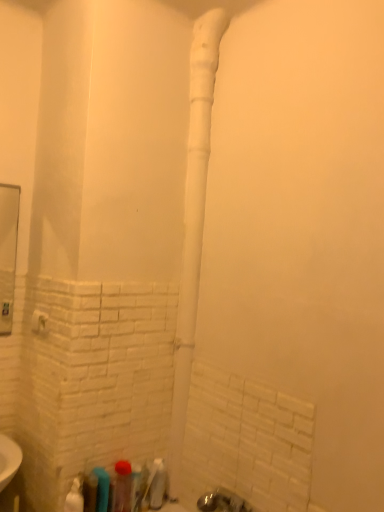
The width and height of the screenshot is (384, 512). Describe the element at coordinates (90, 492) in the screenshot. I see `translucent plastic bottle at lower left, which is the fifth toiletry from right to left` at that location.

In order to face translucent plastic bottle at lower center, which is the fourth toiletry from left to right, should I rotate leftwards or rightwards?

You should rotate left by 9.061 degrees.

Image resolution: width=384 pixels, height=512 pixels. Describe the element at coordinates (122, 487) in the screenshot. I see `translucent plastic bottle at lower center, which is the fourth toiletry from left to right` at that location.

What do you see at coordinates (74, 498) in the screenshot? Image resolution: width=384 pixels, height=512 pixels. I see `white glossy spray bottle at lower left, which is counted as the sixth toiletry, starting from the right` at bounding box center [74, 498].

This screenshot has height=512, width=384. What are the coordinates of `translucent plastic bottle at lower center, which ranks as the sixth toiletry in left-to-right order` in the screenshot? It's located at (157, 483).

Where is `towel bar above the white glossy spray bottle at lower left, the 1th toiletry positioned from the left (from the image's perspective)`? This screenshot has width=384, height=512. towel bar above the white glossy spray bottle at lower left, the 1th toiletry positioned from the left (from the image's perspective) is located at coordinates (40, 322).

From the picture: How far apart are white glossy spray bottle at lower left, the 1th toiletry positioned from the left, and white plastic towel bar at lower left?

The distance of white glossy spray bottle at lower left, the 1th toiletry positioned from the left, from white plastic towel bar at lower left is 23.30 inches.

In the scene shown: In the image, is white glossy spray bottle at lower left, which is counted as the sixth toiletry, starting from the right, positioned in front of or behind white plastic towel bar at lower left?

Clearly, white glossy spray bottle at lower left, which is counted as the sixth toiletry, starting from the right, is in front of white plastic towel bar at lower left.

In terms of size, does white glossy spray bottle at lower left, the 1th toiletry positioned from the left, appear bigger or smaller than white plastic towel bar at lower left?

Considering their sizes, white glossy spray bottle at lower left, the 1th toiletry positioned from the left, takes up more space than white plastic towel bar at lower left.

Identify the location of toiletry that is the 2nd object located above the translucent plastic bottle at lower left, which is counted as the second toiletry, starting from the left (from the image's perspective). (74, 498).

Which is nearer, (84, 506) or (70, 511)?

Point (84, 506) appears to be farther away from the viewer than point (70, 511).

Is translucent plastic bottle at lower left, which is the fifth toiletry from right to left, taller or shorter than white glossy spray bottle at lower left, the 1th toiletry positioned from the left?

In the image, translucent plastic bottle at lower left, which is the fifth toiletry from right to left, appears to be shorter than white glossy spray bottle at lower left, the 1th toiletry positioned from the left.

Is translucent plastic bottle at lower left, which is the fifth toiletry from right to left, oriented away from white glossy spray bottle at lower left, the 1th toiletry positioned from the left?

No.

Which is less distant, [157,479] or [205,146]?

Clearly, point [157,479] is closer to the camera than point [205,146].

Is translucent plastic bottle at lower center, which ranks as the sixth toiletry in left-to-right order, in contact with white plastic pipe at center?

translucent plastic bottle at lower center, which ranks as the sixth toiletry in left-to-right order, and white plastic pipe at center are not in contact.

Considering the sizes of translucent plastic bottle at lower center, positioned as the 1th toiletry in right-to-left order, and white plastic pipe at center in the image, is translucent plastic bottle at lower center, positioned as the 1th toiletry in right-to-left order, bigger or smaller than white plastic pipe at center?

translucent plastic bottle at lower center, positioned as the 1th toiletry in right-to-left order, is smaller than white plastic pipe at center.

Does translucent plastic bottle at lower center, positioned as the 1th toiletry in right-to-left order, have a greater width compared to white plastic pipe at center?

Incorrect, the width of translucent plastic bottle at lower center, positioned as the 1th toiletry in right-to-left order, does not surpass that of white plastic pipe at center.

Considering the sizes of white glossy spray bottle at lower left, the 1th toiletry positioned from the left, and translucent plastic toothbrush at lower center, the 2th toiletry from the right, in the image, is white glossy spray bottle at lower left, the 1th toiletry positioned from the left, bigger or smaller than translucent plastic toothbrush at lower center, the 2th toiletry from the right,?

In the image, white glossy spray bottle at lower left, the 1th toiletry positioned from the left, appears to be larger than translucent plastic toothbrush at lower center, the 2th toiletry from the right.

Considering the positions of point (73, 488) and point (135, 499), is point (73, 488) closer or farther from the camera than point (135, 499)?

Point (73, 488) is positioned closer to the camera compared to point (135, 499).

Is translucent plastic toothbrush at lower center, the 2th toiletry from the right, at the back of white glossy spray bottle at lower left, which is counted as the sixth toiletry, starting from the right?

No, translucent plastic toothbrush at lower center, the 2th toiletry from the right, is not at the back of white glossy spray bottle at lower left, which is counted as the sixth toiletry, starting from the right.

From a real-world perspective, is translucent plastic bottle at lower left, which is the third toiletry in left-to-right order, physically below translucent plastic bottle at lower center, positioned as the 1th toiletry in right-to-left order?

No, from a real-world perspective, translucent plastic bottle at lower left, which is the third toiletry in left-to-right order, is not below translucent plastic bottle at lower center, positioned as the 1th toiletry in right-to-left order.

Where is `the 3rd toiletry behind the translucent plastic bottle at lower left, the 4th toiletry when ordered from right to left`? The height and width of the screenshot is (512, 384). the 3rd toiletry behind the translucent plastic bottle at lower left, the 4th toiletry when ordered from right to left is located at coordinates (157, 483).

Is translucent plastic bottle at lower left, which is the third toiletry in left-to-right order, situated inside translucent plastic bottle at lower center, positioned as the 1th toiletry in right-to-left order, or outside?

translucent plastic bottle at lower left, which is the third toiletry in left-to-right order, cannot be found inside translucent plastic bottle at lower center, positioned as the 1th toiletry in right-to-left order.

Can you confirm if translucent plastic bottle at lower left, the 4th toiletry when ordered from right to left, is shorter than translucent plastic bottle at lower center, which ranks as the sixth toiletry in left-to-right order?

No, translucent plastic bottle at lower left, the 4th toiletry when ordered from right to left, is not shorter than translucent plastic bottle at lower center, which ranks as the sixth toiletry in left-to-right order.

Is translucent plastic bottle at lower left, which is the fifth toiletry from right to left, shorter than translucent plastic bottle at lower center, positioned as the 1th toiletry in right-to-left order?

No, translucent plastic bottle at lower left, which is the fifth toiletry from right to left, is not shorter than translucent plastic bottle at lower center, positioned as the 1th toiletry in right-to-left order.

From a real-world perspective, is translucent plastic bottle at lower left, which is counted as the second toiletry, starting from the left, located beneath translucent plastic bottle at lower center, positioned as the 1th toiletry in right-to-left order?

No, from a real-world perspective, translucent plastic bottle at lower left, which is counted as the second toiletry, starting from the left, is not beneath translucent plastic bottle at lower center, positioned as the 1th toiletry in right-to-left order.

Can you tell me how much translucent plastic bottle at lower left, which is counted as the second toiletry, starting from the left, and translucent plastic bottle at lower center, which ranks as the sixth toiletry in left-to-right order, differ in facing direction?

There is a 0.00436-degree angle between the facing directions of translucent plastic bottle at lower left, which is counted as the second toiletry, starting from the left, and translucent plastic bottle at lower center, which ranks as the sixth toiletry in left-to-right order.

Considering the relative sizes of translucent plastic toothbrush at lower center, the 2th toiletry from the right, and white glossy spray bottle at lower left, which is counted as the sixth toiletry, starting from the right, in the image provided, is translucent plastic toothbrush at lower center, the 2th toiletry from the right, taller than white glossy spray bottle at lower left, which is counted as the sixth toiletry, starting from the right,?

In fact, translucent plastic toothbrush at lower center, the 2th toiletry from the right, may be shorter than white glossy spray bottle at lower left, which is counted as the sixth toiletry, starting from the right.

Which object is positioned more to the right, translucent plastic toothbrush at lower center, the 2th toiletry from the right, or white glossy spray bottle at lower left, which is counted as the sixth toiletry, starting from the right?

translucent plastic toothbrush at lower center, the 2th toiletry from the right, is more to the right.

From a real-world perspective, which object stands above the other?

white glossy spray bottle at lower left, the 1th toiletry positioned from the left, from a real-world perspective.

This screenshot has width=384, height=512. What are the coordinates of `the 1st toiletry to the right of the white plastic towel bar at lower left, counting from the anchor's position` in the screenshot? It's located at (74, 498).

You are a GUI agent. You are given a task and a screenshot of the screen. Output one action in this format:
    pyautogui.click(x=<x>, y=<y>)
    Task: Click on the 2nd toiletry above when counting from the translucent plastic bottle at lower left, which is the fifth toiletry from right to left (from the image's perspective)
    
    Given the screenshot: What is the action you would take?
    pyautogui.click(x=74, y=498)

From the picture: From the image, which object appears to be nearer to white glossy spray bottle at lower left, which is counted as the sixth toiletry, starting from the right, translucent plastic toothbrush at lower center, the fifth toiletry viewed from the left, or white plastic pipe at center?

translucent plastic toothbrush at lower center, the fifth toiletry viewed from the left, is positioned closer to the anchor white glossy spray bottle at lower left, which is counted as the sixth toiletry, starting from the right.

Looking at this image, estimate the real-world distances between objects in this image. Which object is further from white glossy spray bottle at lower left, which is counted as the sixth toiletry, starting from the right, translucent plastic bottle at lower left, which is the fifth toiletry from right to left, or translucent plastic toothbrush at lower center, the fifth toiletry viewed from the left?

translucent plastic toothbrush at lower center, the fifth toiletry viewed from the left, is positioned further to the anchor white glossy spray bottle at lower left, which is counted as the sixth toiletry, starting from the right.

From the image, which object appears to be nearer to translucent plastic bottle at lower left, which is counted as the second toiletry, starting from the left, translucent plastic bottle at lower left, which is the third toiletry in left-to-right order, or translucent plastic toothbrush at lower center, the 2th toiletry from the right?

Among the two, translucent plastic bottle at lower left, which is the third toiletry in left-to-right order, is located nearer to translucent plastic bottle at lower left, which is counted as the second toiletry, starting from the left.

From the picture: Based on their spatial positions, is white plastic pipe at center or translucent plastic bottle at lower center, the third toiletry from the right, further from translucent plastic bottle at lower left, which is the third toiletry in left-to-right order?

The object further to translucent plastic bottle at lower left, which is the third toiletry in left-to-right order, is white plastic pipe at center.

When comparing their distances from translucent plastic bottle at lower center, the third toiletry from the right, does white plastic towel bar at lower left or translucent plastic bottle at lower left, which is the fifth toiletry from right to left, seem closer?

translucent plastic bottle at lower left, which is the fifth toiletry from right to left, is positioned closer to the anchor translucent plastic bottle at lower center, the third toiletry from the right.

Estimate the real-world distances between objects in this image. Which object is closer to translucent plastic bottle at lower left, which is the third toiletry in left-to-right order, white glossy spray bottle at lower left, which is counted as the sixth toiletry, starting from the right, or translucent plastic bottle at lower center, which is the fourth toiletry from left to right?

translucent plastic bottle at lower center, which is the fourth toiletry from left to right, lies closer to translucent plastic bottle at lower left, which is the third toiletry in left-to-right order, than the other object.

From the image, which object appears to be nearer to translucent plastic bottle at lower center, the third toiletry from the right, white glossy spray bottle at lower left, the 1th toiletry positioned from the left, or translucent plastic bottle at lower center, positioned as the 1th toiletry in right-to-left order?

The object closer to translucent plastic bottle at lower center, the third toiletry from the right, is translucent plastic bottle at lower center, positioned as the 1th toiletry in right-to-left order.

In the scene shown: When comparing their distances from translucent plastic bottle at lower center, positioned as the 1th toiletry in right-to-left order, does white plastic pipe at center or white plastic towel bar at lower left seem closer?

The object closer to translucent plastic bottle at lower center, positioned as the 1th toiletry in right-to-left order, is white plastic pipe at center.

Find the location of a particular element. The width and height of the screenshot is (384, 512). towel bar between white plastic pipe at center and translucent plastic bottle at lower left, which is the third toiletry in left-to-right order, in the up-down direction is located at coordinates (40, 322).

Find the location of `towel bar between white plastic pipe at center and translucent plastic bottle at lower left, which is counted as the second toiletry, starting from the left, in the up-down direction`. towel bar between white plastic pipe at center and translucent plastic bottle at lower left, which is counted as the second toiletry, starting from the left, in the up-down direction is located at coordinates (40, 322).

I want to click on toiletry located between translucent plastic bottle at lower left, the 4th toiletry when ordered from right to left, and translucent plastic toothbrush at lower center, the fifth toiletry viewed from the left, in the depth direction, so click(122, 487).

At what (x,y) coordinates should I click in order to perform the action: click on toiletry between white plastic pipe at center and white glossy spray bottle at lower left, the 1th toiletry positioned from the left, from top to bottom. Please return your answer as a coordinate pair (x, y). This screenshot has height=512, width=384. Looking at the image, I should click on (122, 487).